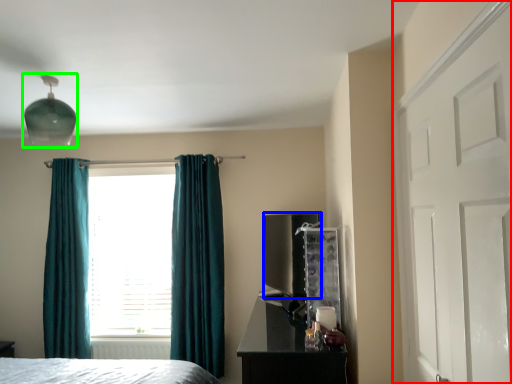
Question: Which object is positioned farthest from door (highlighted by a red box)? Select from appliance (highlighted by a blue box) and light fixture (highlighted by a green box).

Choices:
 (A) appliance
 (B) light fixture

Answer: (B)